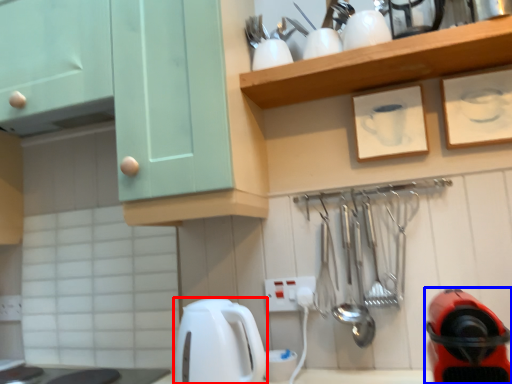
Question: Which object is closer to the camera taking this photo, kitchen appliance (highlighted by a red box) or home appliance (highlighted by a blue box)?

Choices:
 (A) kitchen appliance
 (B) home appliance

Answer: (B)